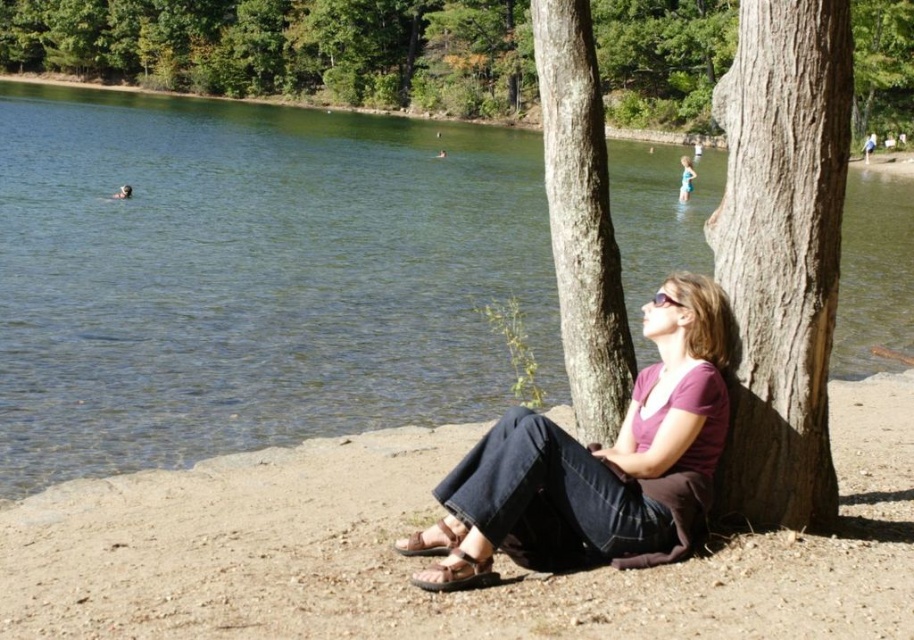
You are standing at the point marked by the coordinates point (287, 49) and want to walk towards the woman seated under the trees. Which direction should you head to reach her?

The brown textured tree at center is represented by point (287, 49). Since the woman is seated on the ground leaning against one of the trees at the lakeside, you should head towards the direction where the woman is located, which is away from the point (287, 49) towards the shoreline where she is sitting.

Based on the photo, you are a photographer trying to capture the purple matte shirt at center and the brown dirt shoreline at lower left in the same frame. Based on their positions, which object is closer to the left edge of the photo?

The purple matte shirt at center is closer to the left edge of the photo because the brown dirt shoreline at lower left is positioned to the right of it.